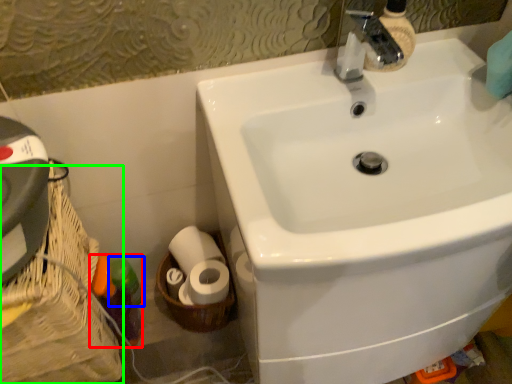
Question: Which is nearer to the bottle (highlighted by a red box)? toiletry (highlighted by a blue box) or basket container (highlighted by a green box).

Choices:
 (A) toiletry
 (B) basket container

Answer: (A)